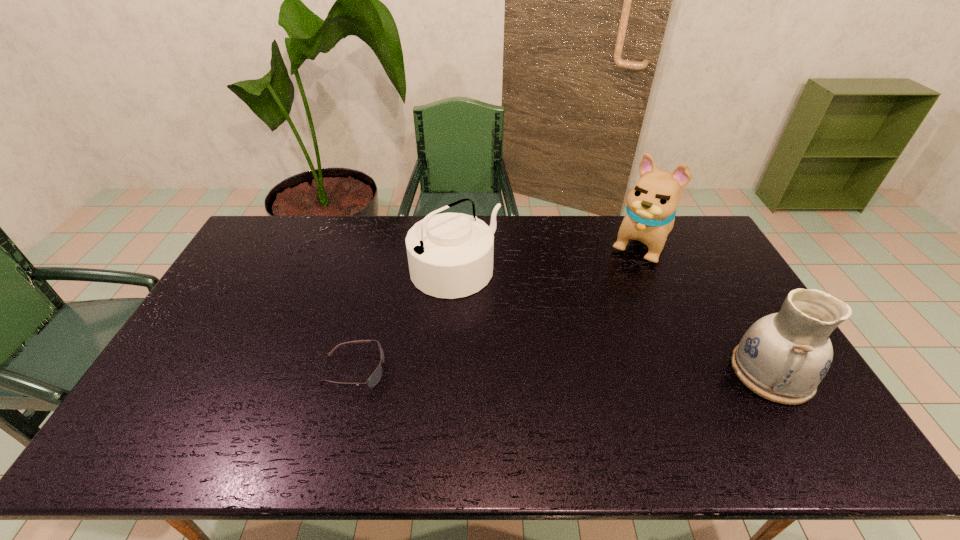
The height and width of the screenshot is (540, 960). What are the coordinates of `vacant area that lies between the kettle and the sunglasses` in the screenshot? It's located at (404, 320).

You are a GUI agent. You are given a task and a screenshot of the screen. Output one action in this format:
    pyautogui.click(x=<x>, y=<y>)
    Task: Click on the free spot between the puppy and the sunglasses
    
    Given the screenshot: What is the action you would take?
    [497, 307]

This screenshot has width=960, height=540. In order to click on free point between the leftmost object and the kettle in this screenshot , I will do `click(404, 320)`.

The image size is (960, 540). What are the coordinates of `unoccupied position between the second object from left to right and the pottery` in the screenshot? It's located at (613, 321).

Locate an element on the screen. vacant region between the third object from right to left and the sunglasses is located at coordinates pyautogui.click(x=404, y=320).

At what (x,y) coordinates should I click in order to perform the action: click on vacant area that lies between the puppy and the pottery. Please return your answer as a coordinate pair (x, y). This screenshot has width=960, height=540. Looking at the image, I should click on (707, 307).

Choose which object is the nearest neighbor to the second object from left to right. Please provide its 2D coordinates. Your answer should be formatted as a tuple, i.e. [(x, y)], where the tuple contains the x and y coordinates of a point satisfying the conditions above.

[(373, 380)]

Choose which object is the nearest neighbor to the kettle. Please provide its 2D coordinates. Your answer should be formatted as a tuple, i.e. [(x, y)], where the tuple contains the x and y coordinates of a point satisfying the conditions above.

[(373, 380)]

Locate an element on the screen. free space that satisfies the following two spatial constraints: 1. on the back side of the kettle; 2. on the left side of the tallest object is located at coordinates (457, 243).

Where is `free spot that satisfies the following two spatial constraints: 1. on the front side of the tallest object; 2. on the right side of the pottery`? The width and height of the screenshot is (960, 540). free spot that satisfies the following two spatial constraints: 1. on the front side of the tallest object; 2. on the right side of the pottery is located at coordinates (699, 372).